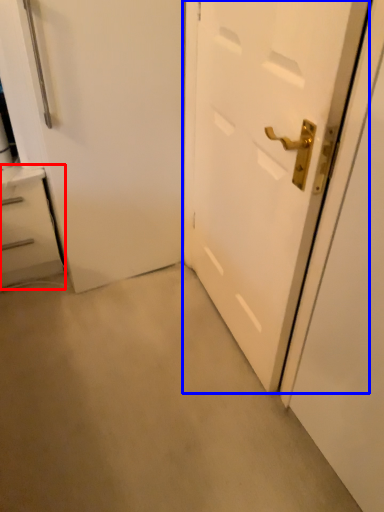
Question: Which object appears closest to the camera in this image, chest of drawers (highlighted by a red box) or door (highlighted by a blue box)?

Choices:
 (A) chest of drawers
 (B) door

Answer: (B)